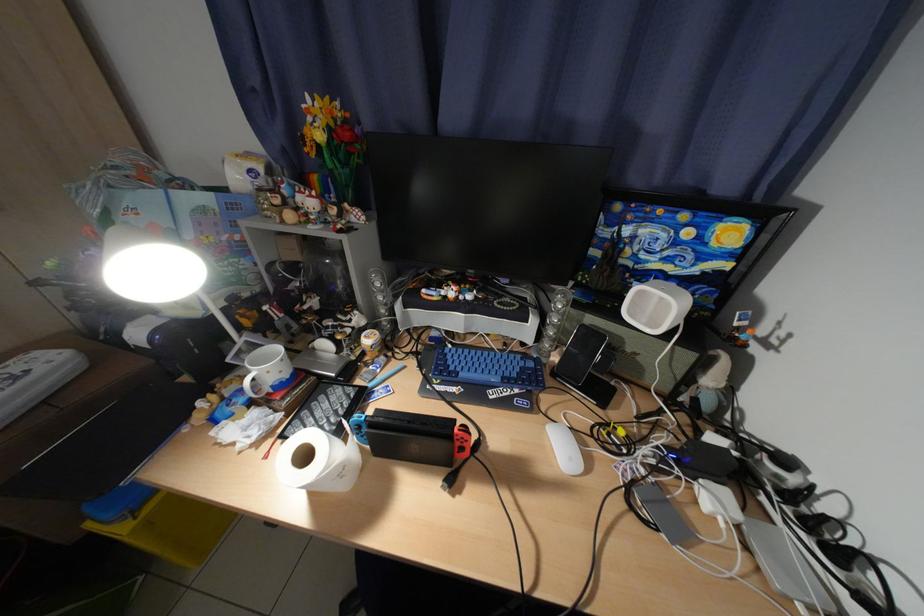
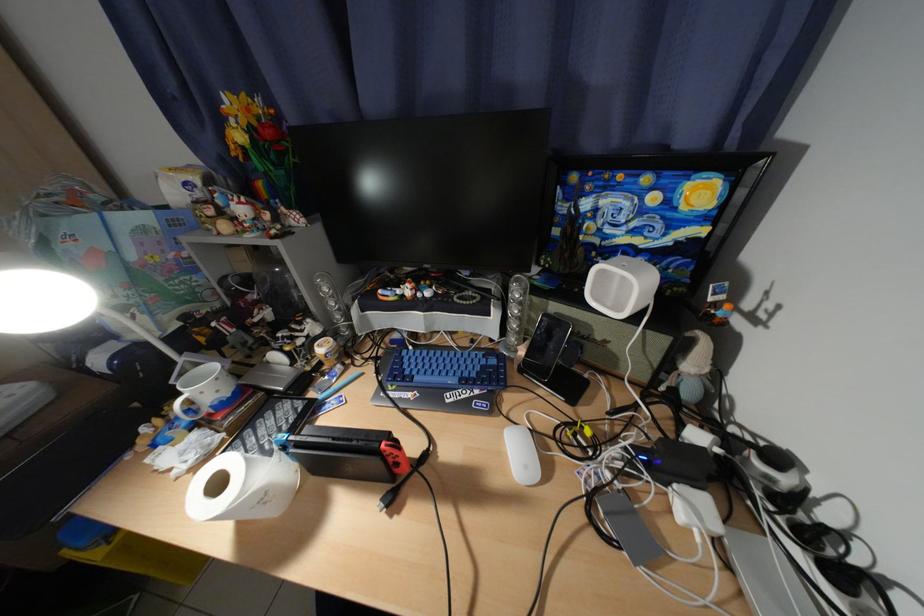
In a continuous first-person perspective shot, in which direction is the camera moving?

The cameraman moved toward right, forward.